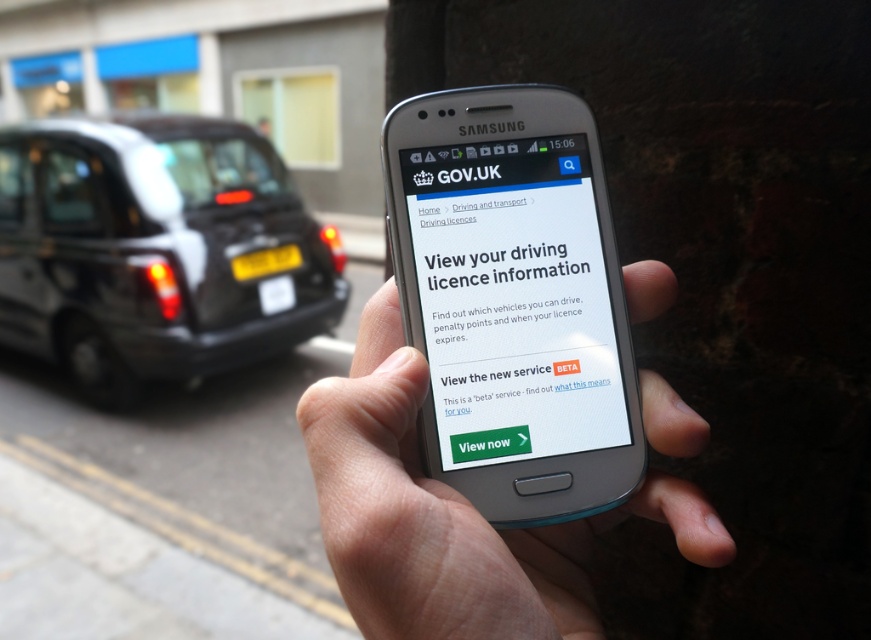
Does black metallic taxi at left have a lesser height compared to smooth skin hand at center?

Incorrect, black metallic taxi at left's height does not fall short of smooth skin hand at center's.

Image resolution: width=871 pixels, height=640 pixels. Find the location of `black metallic taxi at left`. black metallic taxi at left is located at coordinates (156, 250).

This screenshot has width=871, height=640. Find the location of `black metallic taxi at left`. black metallic taxi at left is located at coordinates (156, 250).

Looking at this image, measure the distance from black metallic taxi at left to white glossy screen at center.

black metallic taxi at left is 2.53 meters away from white glossy screen at center.

Does black metallic taxi at left come in front of white glossy screen at center?

No, it is behind white glossy screen at center.

Identify the location of black metallic taxi at left. (156, 250).

Is smooth skin hand at center wider than white glossy screen at center?

Indeed, smooth skin hand at center has a greater width compared to white glossy screen at center.

Is smooth skin hand at center positioned behind white glossy screen at center?

No.

This screenshot has height=640, width=871. I want to click on smooth skin hand at center, so click(x=451, y=515).

Identify the location of smooth skin hand at center. This screenshot has width=871, height=640. (451, 515).